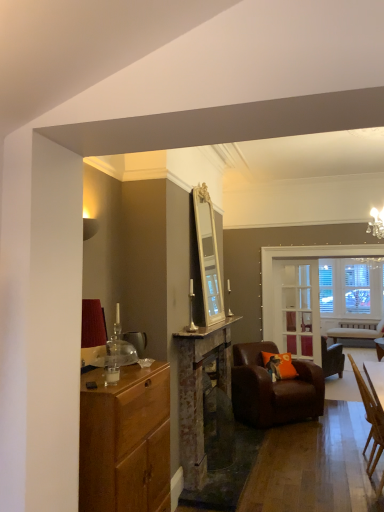
Question: Can you confirm if rustic stone fireplace at center is thinner than light brown wooden chair at lower right, which ranks as the 3th chair in back-to-front order?

Choices:
 (A) no
 (B) yes

Answer: (B)

Question: Does rustic stone fireplace at center lie in front of light brown wooden chair at lower right, which ranks as the 3th chair in back-to-front order?

Choices:
 (A) no
 (B) yes

Answer: (B)

Question: Is rustic stone fireplace at center taller than light brown wooden chair at lower right, which ranks as the 3th chair in back-to-front order?

Choices:
 (A) no
 (B) yes

Answer: (B)

Question: From the image's perspective, is rustic stone fireplace at center beneath light brown wooden chair at lower right, the first chair positioned from the front?

Choices:
 (A) yes
 (B) no

Answer: (B)

Question: Are rustic stone fireplace at center and light brown wooden chair at lower right, which ranks as the 3th chair in back-to-front order, located far from each other?

Choices:
 (A) yes
 (B) no

Answer: (A)

Question: From a real-world perspective, is rustic stone fireplace at center positioned under light brown wooden chair at lower right, the first chair positioned from the front, based on gravity?

Choices:
 (A) no
 (B) yes

Answer: (A)

Question: Considering the relative sizes of rustic stone fireplace at center and clear glass door at center in the image provided, is rustic stone fireplace at center shorter than clear glass door at center?

Choices:
 (A) no
 (B) yes

Answer: (B)

Question: From a real-world perspective, is rustic stone fireplace at center below clear glass door at center?

Choices:
 (A) no
 (B) yes

Answer: (B)

Question: Can you confirm if rustic stone fireplace at center is smaller than clear glass door at center?

Choices:
 (A) yes
 (B) no

Answer: (B)

Question: Is rustic stone fireplace at center positioned beyond the bounds of clear glass door at center?

Choices:
 (A) no
 (B) yes

Answer: (B)

Question: Would you consider rustic stone fireplace at center to be distant from clear glass door at center?

Choices:
 (A) yes
 (B) no

Answer: (A)

Question: Is rustic stone fireplace at center further to the viewer compared to clear glass door at center?

Choices:
 (A) no
 (B) yes

Answer: (A)

Question: From the image's perspective, is marble counter top at center above clear glass door at center?

Choices:
 (A) no
 (B) yes

Answer: (B)